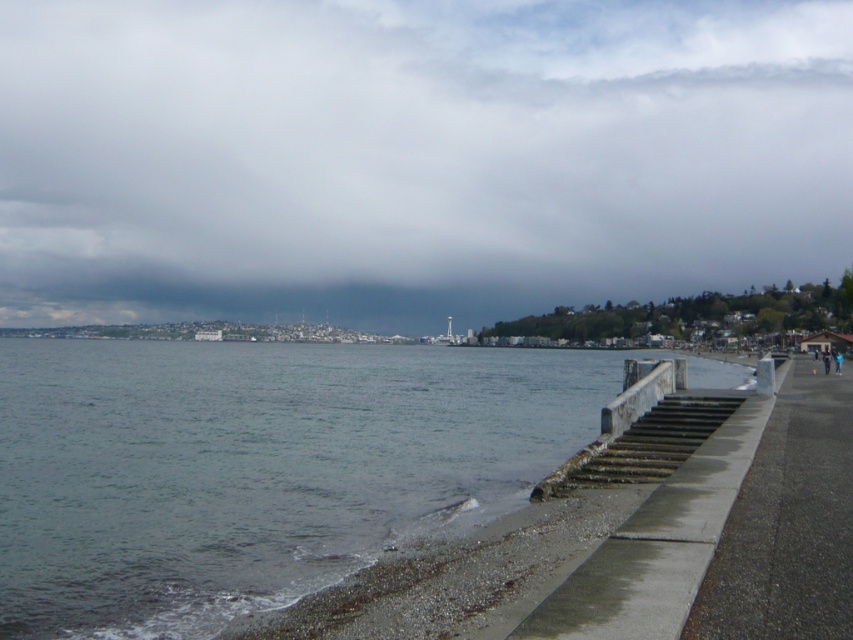
Question: Which of these objects is positioned closest to the gray concrete pavement at lower right?

Choices:
 (A) dark gray cloud at upper center
 (B) clear water at lower left
 (C) concrete stairs at lower right

Answer: (C)

Question: Can you confirm if gray concrete pavement at lower right is bigger than concrete stairs at lower right?

Choices:
 (A) yes
 (B) no

Answer: (A)

Question: Considering the real-world distances, which object is closest to the concrete stairs at lower right?

Choices:
 (A) dark gray cloud at upper center
 (B) clear water at lower left
 (C) gray concrete pavement at lower right

Answer: (C)

Question: Is dark gray cloud at upper center further to the viewer compared to clear water at lower left?

Choices:
 (A) no
 (B) yes

Answer: (B)

Question: Is dark gray cloud at upper center wider than concrete stairs at lower right?

Choices:
 (A) yes
 (B) no

Answer: (A)

Question: Which of the following is the farthest from the observer?

Choices:
 (A) concrete stairs at lower right
 (B) gray concrete pavement at lower right

Answer: (A)